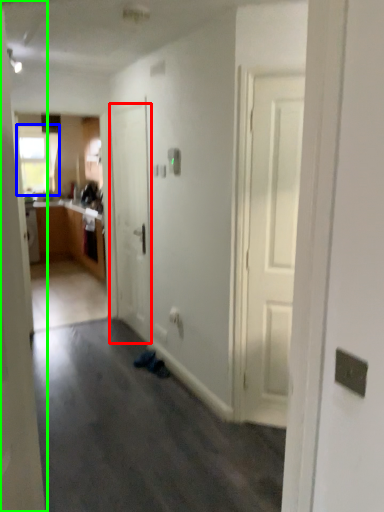
Question: Which is nearer to the door (highlighted by a red box)? window (highlighted by a blue box) or door (highlighted by a green box).

Choices:
 (A) window
 (B) door

Answer: (B)